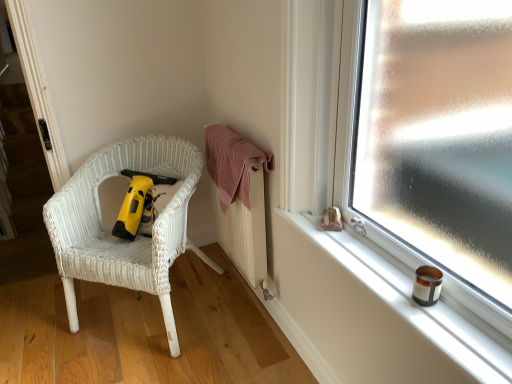
Question: Is yellow plastic vacuum at left far from smooth white window sill at right?

Choices:
 (A) no
 (B) yes

Answer: (A)

Question: Does yellow plastic vacuum at left lie behind smooth white window sill at right?

Choices:
 (A) no
 (B) yes

Answer: (B)

Question: Considering the relative sizes of yellow plastic vacuum at left and smooth white window sill at right in the image provided, is yellow plastic vacuum at left bigger than smooth white window sill at right?

Choices:
 (A) no
 (B) yes

Answer: (B)

Question: Does yellow plastic vacuum at left appear on the left side of smooth white window sill at right?

Choices:
 (A) yes
 (B) no

Answer: (A)

Question: Is yellow plastic vacuum at left shorter than smooth white window sill at right?

Choices:
 (A) yes
 (B) no

Answer: (B)

Question: Which is correct: pink cotton towel at center is inside white wicker chair at left, or outside of it?

Choices:
 (A) outside
 (B) inside

Answer: (A)

Question: Is pink cotton towel at center in front of or behind white wicker chair at left in the image?

Choices:
 (A) front
 (B) behind

Answer: (B)

Question: Is point (x=229, y=160) closer or farther from the camera than point (x=162, y=233)?

Choices:
 (A) closer
 (B) farther

Answer: (B)

Question: From a real-world perspective, relative to white wicker chair at left, is pink cotton towel at center vertically above or below?

Choices:
 (A) below
 (B) above

Answer: (B)

Question: Does point (87, 246) appear closer or farther from the camera than point (247, 196)?

Choices:
 (A) farther
 (B) closer

Answer: (A)

Question: Would you say white wicker chair at left is to the left or to the right of pink cotton towel at center in the picture?

Choices:
 (A) right
 (B) left

Answer: (B)

Question: Considering the positions of white wicker chair at left and pink cotton towel at center in the image, is white wicker chair at left taller or shorter than pink cotton towel at center?

Choices:
 (A) tall
 (B) short

Answer: (A)

Question: Based on their sizes in the image, would you say white wicker chair at left is bigger or smaller than pink cotton towel at center?

Choices:
 (A) small
 (B) big

Answer: (B)

Question: From a real-world perspective, is yellow plastic vacuum at left above or below smooth white window sill at right?

Choices:
 (A) above
 (B) below

Answer: (B)

Question: Is yellow plastic vacuum at left spatially inside smooth white window sill at right, or outside of it?

Choices:
 (A) inside
 (B) outside

Answer: (B)